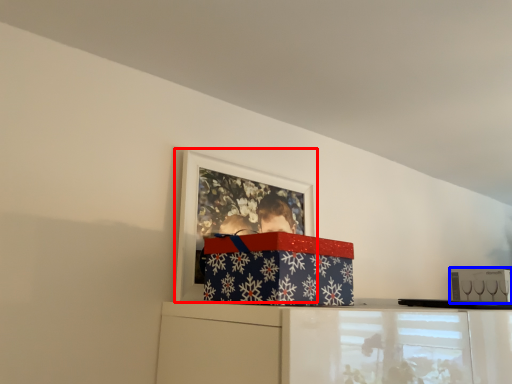
Question: Which of the following is the farthest to the observer, picture frame (highlighted by a red box) or box (highlighted by a blue box)?

Choices:
 (A) picture frame
 (B) box

Answer: (B)